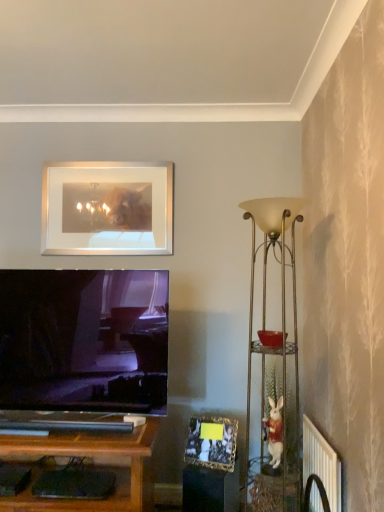
This screenshot has height=512, width=384. Find the location of `gold metallic photo frame at lower center, positioned as the 1th picture frame in right-to-left order`. gold metallic photo frame at lower center, positioned as the 1th picture frame in right-to-left order is located at coordinates tap(212, 443).

The width and height of the screenshot is (384, 512). Describe the element at coordinates (273, 362) in the screenshot. I see `metallic gold floor lamp at right` at that location.

Where is `gold metallic photo frame at lower center, marked as the 2th picture frame in a back-to-front arrangement`? The width and height of the screenshot is (384, 512). gold metallic photo frame at lower center, marked as the 2th picture frame in a back-to-front arrangement is located at coordinates (212, 443).

From the picture: Is gold metallic photo frame at lower center, positioned as the 1th picture frame in right-to-left order, positioned in front of white ceramic rabbit at right?

No, it is behind white ceramic rabbit at right.

Which object is thinner, gold metallic photo frame at lower center, placed as the first picture frame when sorted from bottom to top, or white ceramic rabbit at right?

With smaller width is gold metallic photo frame at lower center, placed as the first picture frame when sorted from bottom to top.

Is gold metallic photo frame at lower center, acting as the 2th picture frame starting from the top, at the left side of white ceramic rabbit at right?

Yes.

Is gold metallic photo frame at lower center, acting as the 2th picture frame starting from the top, located outside white ceramic rabbit at right?

Yes, gold metallic photo frame at lower center, acting as the 2th picture frame starting from the top, is not within white ceramic rabbit at right.

Considering the positions of point (254, 470) and point (44, 199), is point (254, 470) closer or farther from the camera than point (44, 199)?

Clearly, point (254, 470) is closer to the camera than point (44, 199).

Which object is positioned more to the right, metallic gold floor lamp at right or silver/metallic picture frame at upper center, the second picture frame positioned from the front?

Positioned to the right is metallic gold floor lamp at right.

Is metallic gold floor lamp at right positioned before silver/metallic picture frame at upper center, which is the 1th picture frame in top-to-bottom order?

Yes, the depth of metallic gold floor lamp at right is less than that of silver/metallic picture frame at upper center, which is the 1th picture frame in top-to-bottom order.

Would you say metallic gold floor lamp at right is outside silver/metallic picture frame at upper center, placed as the 1th picture frame when sorted from left to right?

Yes, metallic gold floor lamp at right is located beyond the bounds of silver/metallic picture frame at upper center, placed as the 1th picture frame when sorted from left to right.

Is silver/metallic picture frame at upper center, which appears as the 1th picture frame when viewed from the back, aimed at white plastic radiator at lower right?

No, silver/metallic picture frame at upper center, which appears as the 1th picture frame when viewed from the back, does not turn towards white plastic radiator at lower right.

Who is smaller, silver/metallic picture frame at upper center, which is the 2th picture frame from right to left, or white plastic radiator at lower right?

white plastic radiator at lower right is smaller.

From the image's perspective, which one is positioned higher, silver/metallic picture frame at upper center, which is the 1th picture frame in top-to-bottom order, or white plastic radiator at lower right?

From the image's view, silver/metallic picture frame at upper center, which is the 1th picture frame in top-to-bottom order, is above.

Is silver/metallic picture frame at upper center, the second picture frame positioned from the front, not near white plastic radiator at lower right?

That's right, there is a large distance between silver/metallic picture frame at upper center, the second picture frame positioned from the front, and white plastic radiator at lower right.

From the picture: Does white ceramic rabbit at right lie in front of metallic gold floor lamp at right?

No.

How distant is white ceramic rabbit at right from metallic gold floor lamp at right?

white ceramic rabbit at right is 28.91 centimeters from metallic gold floor lamp at right.

Consider the image. Is white ceramic rabbit at right not near metallic gold floor lamp at right?

That's not correct — white ceramic rabbit at right is a little close to metallic gold floor lamp at right.

In terms of width, does white ceramic rabbit at right look wider or thinner when compared to metallic gold floor lamp at right?

Clearly, white ceramic rabbit at right has less width compared to metallic gold floor lamp at right.

Considering the positions of objects silver/metallic picture frame at upper center, placed as the second picture frame when sorted from bottom to top, and white ceramic rabbit at right in the image provided, who is more to the left, silver/metallic picture frame at upper center, placed as the second picture frame when sorted from bottom to top, or white ceramic rabbit at right?

silver/metallic picture frame at upper center, placed as the second picture frame when sorted from bottom to top, is more to the left.

Would you say silver/metallic picture frame at upper center, placed as the 1th picture frame when sorted from left to right, is outside white ceramic rabbit at right?

Absolutely, silver/metallic picture frame at upper center, placed as the 1th picture frame when sorted from left to right, is external to white ceramic rabbit at right.

From a real-world perspective, relative to white ceramic rabbit at right, is silver/metallic picture frame at upper center, which appears as the 1th picture frame when viewed from the back, vertically above or below?

From a real-world perspective, silver/metallic picture frame at upper center, which appears as the 1th picture frame when viewed from the back, is physically above white ceramic rabbit at right.

Is point (83, 251) closer or farther from the camera than point (275, 464)?

Clearly, point (83, 251) is more distant from the camera than point (275, 464).

From the image's perspective, is white ceramic rabbit at right located above or below gold metallic photo frame at lower center, placed as the first picture frame when sorted from bottom to top?

Based on their image positions, white ceramic rabbit at right is located above gold metallic photo frame at lower center, placed as the first picture frame when sorted from bottom to top.

Is white ceramic rabbit at right shorter than gold metallic photo frame at lower center, placed as the first picture frame when sorted from bottom to top?

Incorrect, the height of white ceramic rabbit at right does not fall short of that of gold metallic photo frame at lower center, placed as the first picture frame when sorted from bottom to top.

In the scene shown: Considering the relative sizes of white ceramic rabbit at right and gold metallic photo frame at lower center, placed as the 2th picture frame when sorted from left to right, in the image provided, is white ceramic rabbit at right bigger than gold metallic photo frame at lower center, placed as the 2th picture frame when sorted from left to right,?

No, white ceramic rabbit at right is not bigger than gold metallic photo frame at lower center, placed as the 2th picture frame when sorted from left to right.

Which is closer to the camera, (279, 464) or (197, 438)?

Point (279, 464) is positioned closer to the camera compared to point (197, 438).

Between white ceramic rabbit at right and silver/metallic picture frame at upper center, placed as the 1th picture frame when sorted from left to right, which one has larger size?

Bigger between the two is silver/metallic picture frame at upper center, placed as the 1th picture frame when sorted from left to right.

Does point (276, 445) come behind point (58, 182)?

No, (276, 445) is closer to viewer.

What are the coordinates of `picture frame positioned vertically above the white ceramic rabbit at right (from a real-world perspective)` in the screenshot? It's located at (107, 209).

Is silver/metallic picture frame at upper center, which is the 2th picture frame from right to left, completely or partially inside white ceramic rabbit at right?

Definitely not — silver/metallic picture frame at upper center, which is the 2th picture frame from right to left, is not inside white ceramic rabbit at right.

Find the location of a particular element. toy that appears above the gold metallic photo frame at lower center, acting as the 2th picture frame starting from the top (from a real-world perspective) is located at coordinates click(x=275, y=432).

Where is `lamp below the silver/metallic picture frame at upper center, which is the 1th picture frame in top-to-bottom order (from the image's perspective)`? The width and height of the screenshot is (384, 512). lamp below the silver/metallic picture frame at upper center, which is the 1th picture frame in top-to-bottom order (from the image's perspective) is located at coordinates (273, 362).

When comparing their distances from metallic gold floor lamp at right, does white plastic radiator at lower right or white ceramic rabbit at right seem closer?

white ceramic rabbit at right is positioned closer to the anchor metallic gold floor lamp at right.

Estimate the real-world distances between objects in this image. Which object is further from silver/metallic picture frame at upper center, which appears as the 1th picture frame when viewed from the back, metallic gold floor lamp at right or white plastic radiator at lower right?

white plastic radiator at lower right is positioned further to the anchor silver/metallic picture frame at upper center, which appears as the 1th picture frame when viewed from the back.

Which object lies further to the anchor point silver/metallic picture frame at upper center, which appears as the 1th picture frame when viewed from the back, gold metallic photo frame at lower center, positioned as the 1th picture frame in right-to-left order, or white ceramic rabbit at right?

white ceramic rabbit at right.

Looking at the image, which one is located closer to metallic gold floor lamp at right, silver/metallic picture frame at upper center, placed as the second picture frame when sorted from bottom to top, or white plastic radiator at lower right?

white plastic radiator at lower right.

In the scene shown: Looking at the image, which one is located closer to white plastic radiator at lower right, silver/metallic picture frame at upper center, which appears as the 1th picture frame when viewed from the back, or metallic gold floor lamp at right?

metallic gold floor lamp at right is closer to white plastic radiator at lower right.

When comparing their distances from silver/metallic picture frame at upper center, the second picture frame positioned from the front, does white plastic radiator at lower right or gold metallic photo frame at lower center, marked as the 2th picture frame in a back-to-front arrangement, seem further?

white plastic radiator at lower right is positioned further to the anchor silver/metallic picture frame at upper center, the second picture frame positioned from the front.

Based on their spatial positions, is white plastic radiator at lower right or gold metallic photo frame at lower center, acting as the 2th picture frame starting from the top, closer to metallic gold floor lamp at right?

Based on the image, gold metallic photo frame at lower center, acting as the 2th picture frame starting from the top, appears to be nearer to metallic gold floor lamp at right.

Which object lies further to the anchor point gold metallic photo frame at lower center, placed as the first picture frame when sorted from bottom to top, metallic gold floor lamp at right or silver/metallic picture frame at upper center, which is the 1th picture frame in top-to-bottom order?

silver/metallic picture frame at upper center, which is the 1th picture frame in top-to-bottom order, is further to gold metallic photo frame at lower center, placed as the first picture frame when sorted from bottom to top.

Locate an element on the screen. Image resolution: width=384 pixels, height=512 pixels. toy that lies between metallic gold floor lamp at right and white plastic radiator at lower right from top to bottom is located at coordinates (275, 432).

At what (x,y) coordinates should I click in order to perform the action: click on lamp between silver/metallic picture frame at upper center, placed as the second picture frame when sorted from bottom to top, and white plastic radiator at lower right, in the vertical direction. Please return your answer as a coordinate pair (x, y). The height and width of the screenshot is (512, 384). Looking at the image, I should click on (273, 362).

At what (x,y) coordinates should I click in order to perform the action: click on toy between silver/metallic picture frame at upper center, placed as the 1th picture frame when sorted from left to right, and white plastic radiator at lower right in the up-down direction. Please return your answer as a coordinate pair (x, y). Looking at the image, I should click on (275, 432).

At what (x,y) coordinates should I click in order to perform the action: click on lamp between silver/metallic picture frame at upper center, which is the 1th picture frame in top-to-bottom order, and gold metallic photo frame at lower center, acting as the 2th picture frame starting from the top, in the vertical direction. Please return your answer as a coordinate pair (x, y). Looking at the image, I should click on [273, 362].